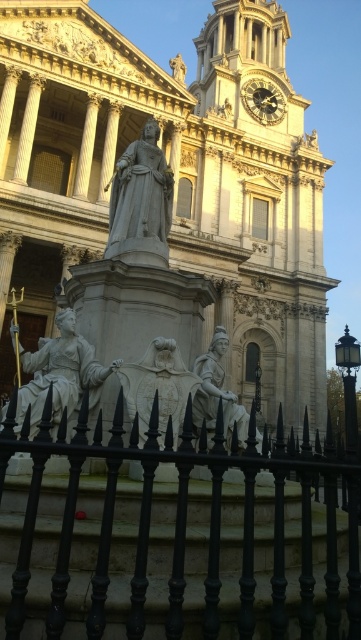
You are standing in front of the cathedral and want to take a photo that includes both the black wrought iron fence at lower center and the statue in front of the building. Since you have a standard camera with a 50mm lens, which has a field of view of about 46 degrees, can you fit both objects into your frame without moving closer or farther away? Please explain your reasoning based on the distance provided.

The black wrought iron fence at lower center is 21.61 meters away from the viewer. To determine if both the fence and the statue can fit into the frame with a 50mm lens, we need to consider the distance and the field of view. However, the exact position and distance of the statue relative to the fence are not provided. Without knowing how far apart the fence and statue are from each other, it is impossible to accurately calculate whether they can both fit within the 46 degree field of view. Additional data,

Consider the image. You are standing in front of the white stone church at center. Where exactly is the church positioned relative to your viewpoint?

The white stone church at center is located at point 0.280 on the horizontal axis and 0.482 on the vertical axis relative to your viewpoint.

You are a tour guide leading a group to the white stone church at center. The group wants to take a photo from a distance that allows them to capture the entire structure without cropping any part of it. Considering the church is 30 meters tall, what is the minimum distance they should stand from the church to achieve this?

The white stone church at center and viewer are 38.35 meters apart from each other. Since the church is 30 meters tall, standing at least 38.35 meters away ensures the entire structure fits in the camera frame without cropping.